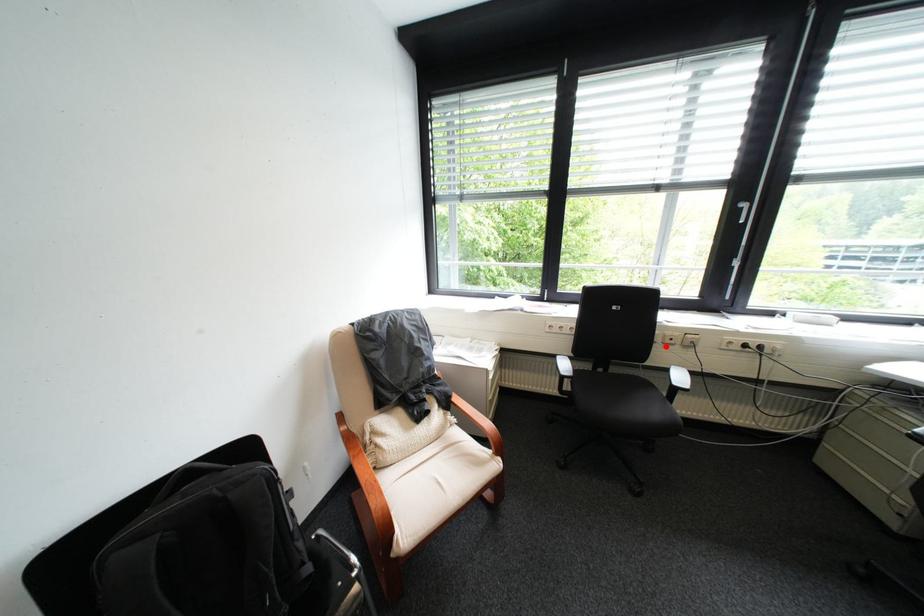
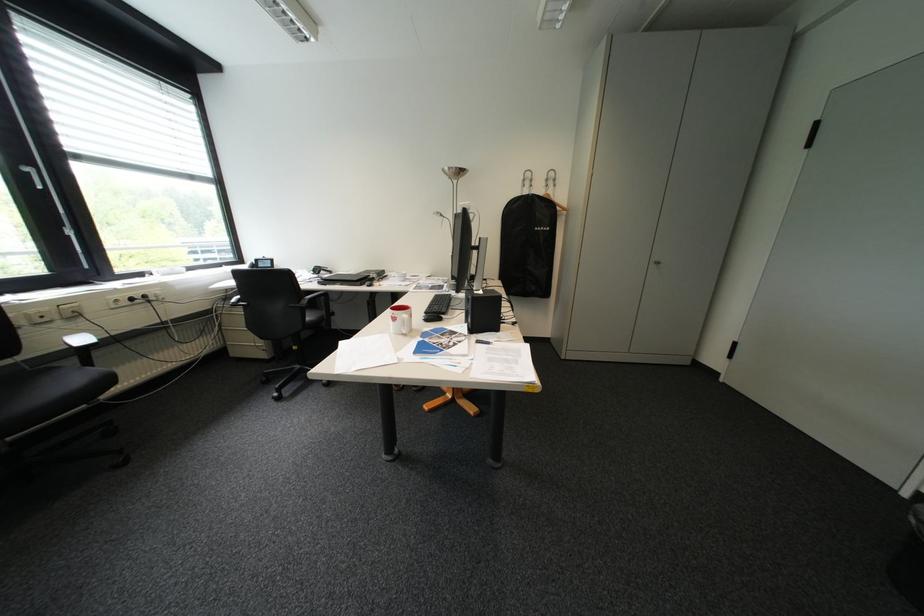
In the second image, find the point that corresponds to the highlighted location in the first image.

(32, 331)